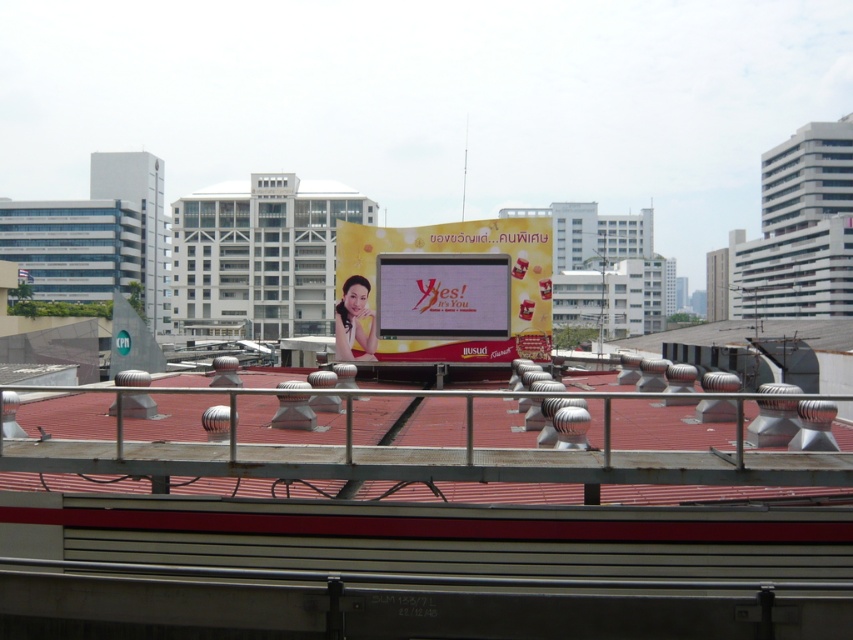
You are standing on the rooftop and want to hang a new banner that needs to be taller than the existing metal at center. Can the yellow fabric billboard at center help you determine if your banner will be tall enough?

The yellow fabric billboard at center is taller than the metal at center. If your banner needs to be taller than the metal at center, the yellow fabric billboard at center can serve as a reference to ensure your banner meets the required height.

From the picture: You are a city planner assessing rooftop space for a new solar panel installation. You observe the rooftop has a metal at center and a yellow fabric billboard at center. Which object takes up more area on the rooftop?

The yellow fabric billboard at center occupies more space than the metal at center, so the billboard takes up more area on the rooftop.

You are standing on the rooftop and want to walk from the point at coordinates point (115, 438) to the point at coordinates point (550, 227). Considering the rooftop layout described, will you pass in front of or behind the large advertisement displayed at the center?

Since point (115, 438) is in front of point (550, 227), walking from point (115, 438) to point (550, 227) means you will be moving towards the direction behind the large advertisement displayed at the center.